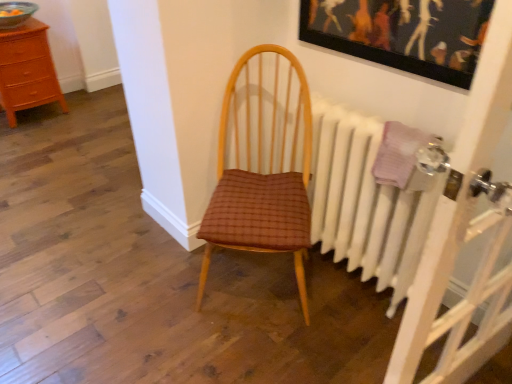
Locate an element on the screen. The height and width of the screenshot is (384, 512). vacant space that is to the left of brown woven fabric chair at center is located at coordinates (147, 286).